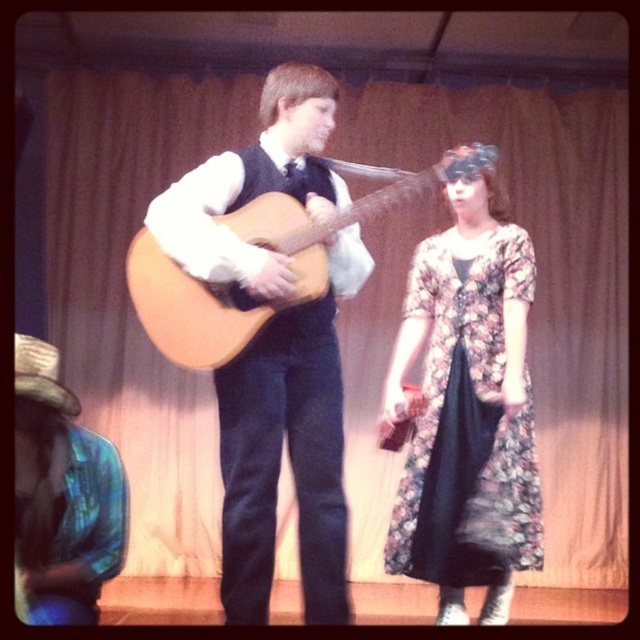
Question: Is floral-patterned fabric dress at center-right in front of blue fabric hat at lower left?

Choices:
 (A) no
 (B) yes

Answer: (A)

Question: Is matte brown guitar at center below light brown acoustic guitar at center?

Choices:
 (A) no
 (B) yes

Answer: (B)

Question: Is matte brown guitar at center thinner than blue fabric hat at lower left?

Choices:
 (A) yes
 (B) no

Answer: (B)

Question: Among these objects, which one is farthest from the camera?

Choices:
 (A) blue fabric hat at lower left
 (B) floral-patterned fabric dress at center-right
 (C) light brown acoustic guitar at center

Answer: (B)

Question: Which object appears closest to the camera in this image?

Choices:
 (A) light brown acoustic guitar at center
 (B) floral-patterned fabric dress at center-right

Answer: (A)

Question: Which point is farther from the camera taking this photo?

Choices:
 (A) (292, 211)
 (B) (419, 504)

Answer: (B)